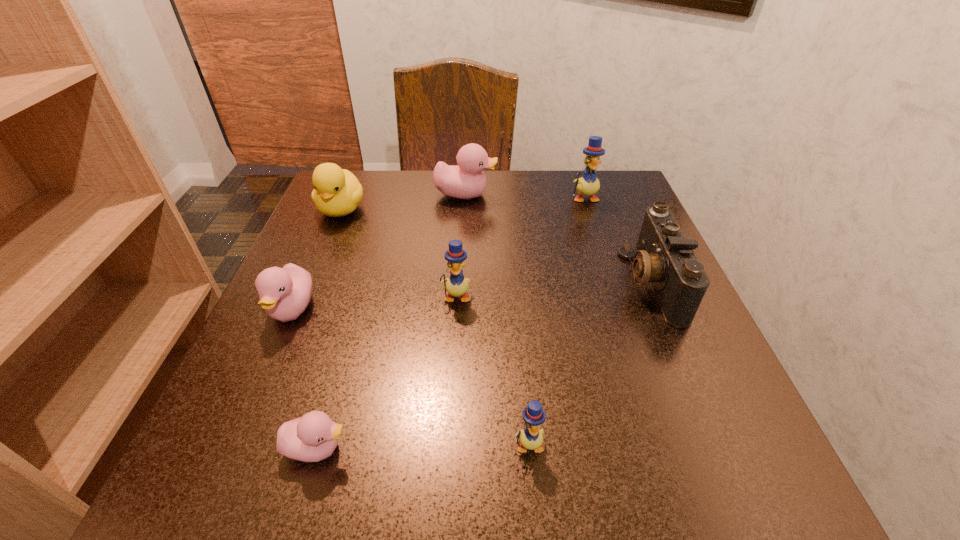
Choose which yellow duckling is the nearest neighbor to the rightmost duckling. Please provide its 2D coordinates. Your answer should be formatted as a tuple, i.e. [(x, y)], where the tuple contains the x and y coordinates of a point satisfying the conditions above.

[(456, 285)]

Where is `the second closest yellow duckling to the leftmost yellow duckling`? Image resolution: width=960 pixels, height=540 pixels. the second closest yellow duckling to the leftmost yellow duckling is located at coordinates (588, 184).

Point out which pink duckling is positioned as the nearest to the fifth duckling from left to right. Please provide its 2D coordinates. Your answer should be formatted as a tuple, i.e. [(x, y)], where the tuple contains the x and y coordinates of a point satisfying the conditions above.

[(311, 438)]

Locate which pink duckling is the closest to the duck. Please provide its 2D coordinates. Your answer should be formatted as a tuple, i.e. [(x, y)], where the tuple contains the x and y coordinates of a point satisfying the conditions above.

[(466, 180)]

You are a GUI agent. You are given a task and a screenshot of the screen. Output one action in this format:
    pyautogui.click(x=<x>, y=<y>)
    Task: Click on the free space that satisfies the following two spatial constraints: 1. on the face of the second nearest yellow duckling, where the monocle is placed; 2. on the front-facing side of the nearest pink duckling
    The width and height of the screenshot is (960, 540).
    Given the screenshot: What is the action you would take?
    pyautogui.click(x=447, y=448)

The width and height of the screenshot is (960, 540). I want to click on free location that satisfies the following two spatial constraints: 1. on the front-facing side of the rightmost pink duckling; 2. on the front-facing side of the second nearest pink duckling, so click(x=460, y=310).

Find the location of a particular element. The image size is (960, 540). free space that satisfies the following two spatial constraints: 1. on the front-facing side of the camera; 2. on the face of the second yellow duckling from left to right, where the monocle is placed is located at coordinates (721, 445).

I want to click on free point that satisfies the following two spatial constraints: 1. on the front-facing side of the camera; 2. on the face of the leftmost yellow duckling, where the monocle is placed, so click(658, 296).

You are a GUI agent. You are given a task and a screenshot of the screen. Output one action in this format:
    pyautogui.click(x=<x>, y=<y>)
    Task: Click on the free region that satisfies the following two spatial constraints: 1. on the front-facing side of the biggest pink duckling; 2. on the front-facing side of the duck
    Image resolution: width=960 pixels, height=540 pixels.
    Given the screenshot: What is the action you would take?
    pyautogui.click(x=465, y=209)

You are a GUI agent. You are given a task and a screenshot of the screen. Output one action in this format:
    pyautogui.click(x=<x>, y=<y>)
    Task: Click on the vacant point that satisfies the following two spatial constraints: 1. on the face of the rightmost yellow duckling, where the monocle is placed; 2. on the front-facing side of the nearest pink duckling
    
    Given the screenshot: What is the action you would take?
    pyautogui.click(x=666, y=448)